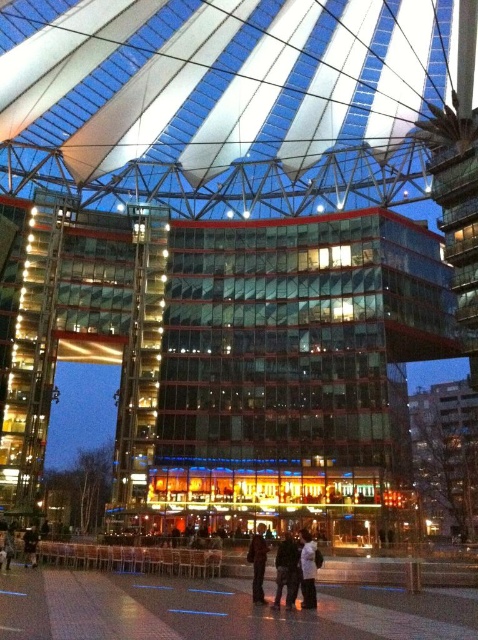
Which is behind, point (293, 563) or point (313, 557)?

Point (313, 557)

Is dark gray pants at center closer to the viewer compared to white matte jacket at center?

Yes, dark gray pants at center is closer to the viewer.

In order to click on dark gray pants at center in this screenshot , I will do `click(286, 570)`.

Is dark gray pants at center positioned before dark blue jeans at center?

Yes, dark gray pants at center is in front of dark blue jeans at center.

Is dark gray pants at center thinner than dark blue jeans at center?

No, dark gray pants at center is not thinner than dark blue jeans at center.

The width and height of the screenshot is (478, 640). In order to click on dark gray pants at center in this screenshot , I will do `click(286, 570)`.

This screenshot has width=478, height=640. I want to click on dark gray pants at center, so click(x=286, y=570).

Is transparent fabric canopy at center wider than dark gray pants at center?

Yes, transparent fabric canopy at center is wider than dark gray pants at center.

Which is behind, point (77, 118) or point (276, 579)?

Point (77, 118)

Who is more forward, [8,29] or [293,540]?

Point [293,540]

This screenshot has width=478, height=640. Identify the location of transparent fabric canopy at center. (223, 97).